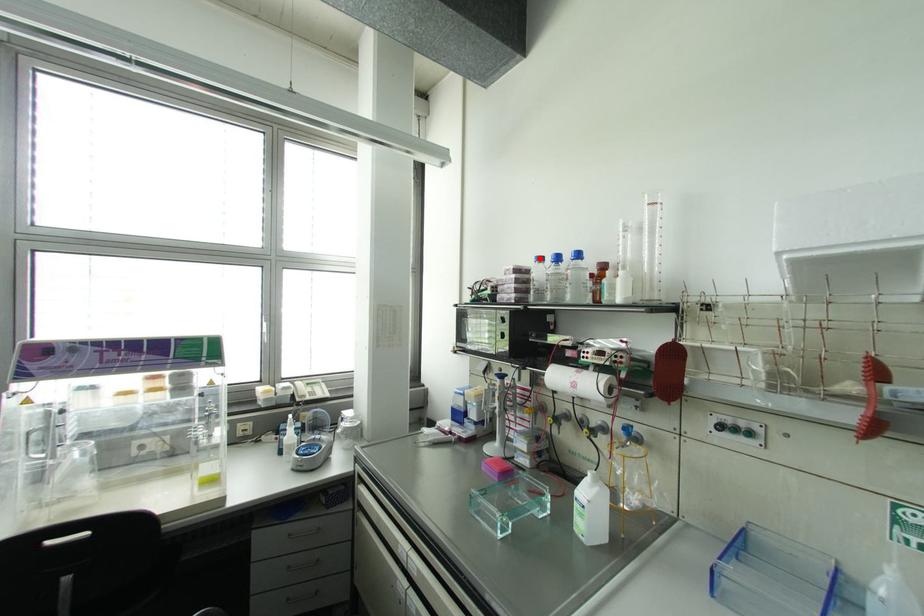
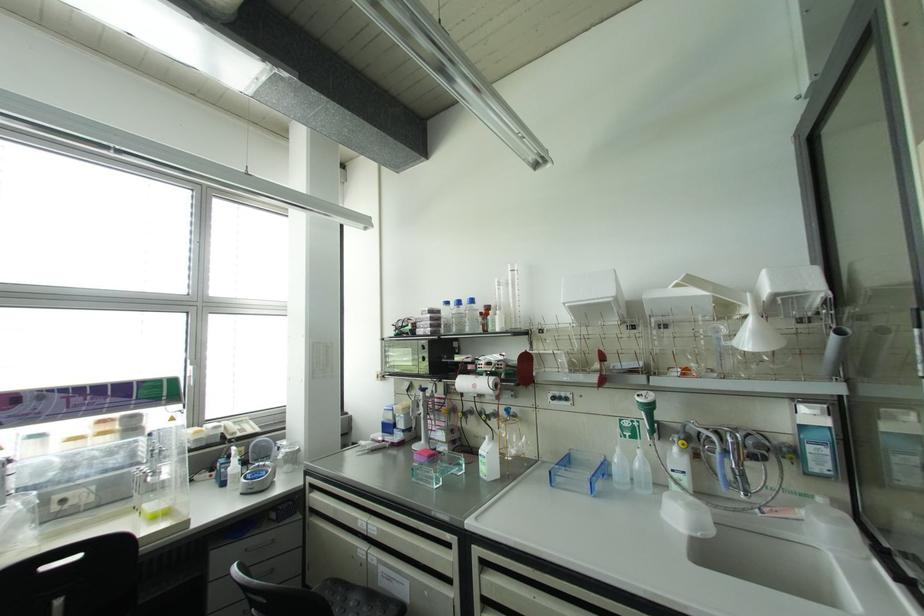
Question: I am providing you with two images of the same scene from different viewpoints. A red point is marked on the first image. Is the red point's position out of view in image 2?

Choices:
 (A) Yes
 (B) No

Answer: (B)